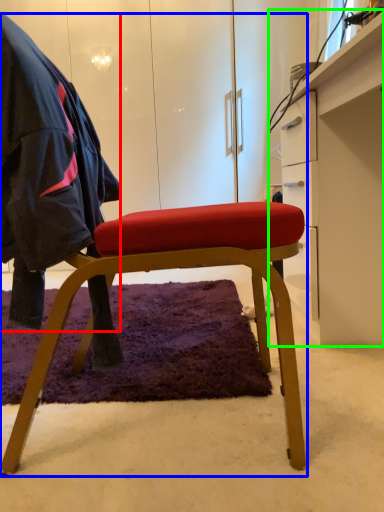
Question: Which is farther away from cloak (highlighted by a red box)? chair (highlighted by a blue box) or desk (highlighted by a green box)?

Choices:
 (A) chair
 (B) desk

Answer: (B)